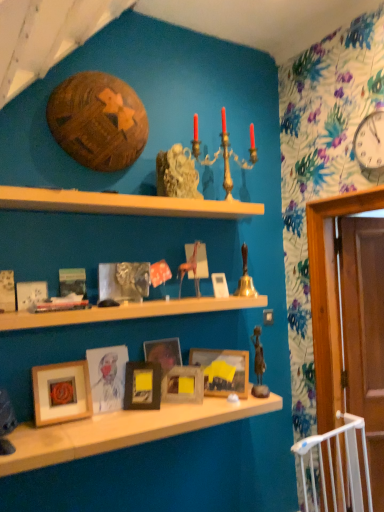
Find the location of a particular element. The width and height of the screenshot is (384, 512). wooden picture frame at lower left, the 6th picture frame when ordered from right to left is located at coordinates (61, 392).

Find the location of a particular element. This screenshot has width=384, height=512. white glossy clock at upper right is located at coordinates (370, 141).

Describe the element at coordinates (122, 431) in the screenshot. I see `wooden shelf at lower center, the first shelf when ordered from bottom to top` at that location.

How much space does wooden picture frame at center, marked as the 3th picture frame in a right-to-left arrangement, occupy horizontally?

It is 1.00 inches.

Where is `wooden picture frame at lower left, the 6th picture frame when ordered from right to left`? The width and height of the screenshot is (384, 512). wooden picture frame at lower left, the 6th picture frame when ordered from right to left is located at coordinates (61, 392).

Between wooden shelf at upper center, the first shelf when ordered from top to bottom, and wooden picture frame at center, marked as the 3th picture frame in a right-to-left arrangement, which one has less height?

With less height is wooden shelf at upper center, the first shelf when ordered from top to bottom.

Would you say wooden shelf at upper center, the third shelf ordered from the bottom, is to the left or to the right of wooden picture frame at center, marked as the 3th picture frame in a right-to-left arrangement, in the picture?

wooden shelf at upper center, the third shelf ordered from the bottom, is positioned on wooden picture frame at center, marked as the 3th picture frame in a right-to-left arrangement,'s left side.

From a real-world perspective, is wooden shelf at upper center, the third shelf ordered from the bottom, positioned above or below wooden picture frame at center, marked as the 3th picture frame in a right-to-left arrangement?

In terms of real-world spatial position, wooden shelf at upper center, the third shelf ordered from the bottom, is above wooden picture frame at center, marked as the 3th picture frame in a right-to-left arrangement.

From the picture: Does wooden shelf at upper center, the first shelf when ordered from top to bottom, contain wooden picture frame at center, marked as the 3th picture frame in a right-to-left arrangement?

No, wooden shelf at upper center, the first shelf when ordered from top to bottom, does not contain wooden picture frame at center, marked as the 3th picture frame in a right-to-left arrangement.

How distant is wooden picture frame at center, arranged as the first picture frame when viewed from the right, from wooden shelf at lower center, the first shelf when ordered from bottom to top?

wooden picture frame at center, arranged as the first picture frame when viewed from the right, is 33.33 inches from wooden shelf at lower center, the first shelf when ordered from bottom to top.

Is wooden picture frame at center, acting as the 7th picture frame starting from the left, turned away from wooden shelf at lower center, the third shelf viewed from the top?

wooden picture frame at center, acting as the 7th picture frame starting from the left, is not turned away from wooden shelf at lower center, the third shelf viewed from the top.

Does point (216, 295) come farther from viewer compared to point (248, 401)?

That is True.

How many degrees apart are the facing directions of wooden picture frame at center, arranged as the first picture frame when viewed from the right, and wooden shelf at lower center, the third shelf viewed from the top?

wooden picture frame at center, arranged as the first picture frame when viewed from the right, and wooden shelf at lower center, the third shelf viewed from the top, are facing 8.67 degrees away from each other.

Which object is thinner, wooden picture frame at center, marked as the 3th picture frame in a right-to-left arrangement, or wooden picture frame at center, acting as the 7th picture frame starting from the left?

With smaller width is wooden picture frame at center, marked as the 3th picture frame in a right-to-left arrangement.

Is there a large distance between wooden picture frame at center, marked as the 3th picture frame in a right-to-left arrangement, and wooden picture frame at center, acting as the 7th picture frame starting from the left?

No.

Can you confirm if wooden picture frame at center, the fifth picture frame from the left, is bigger than wooden picture frame at center, arranged as the first picture frame when viewed from the right?

Correct, wooden picture frame at center, the fifth picture frame from the left, is larger in size than wooden picture frame at center, arranged as the first picture frame when viewed from the right.

From the image's perspective, which one is positioned lower, wooden shelf at lower center, the first shelf when ordered from bottom to top, or matte wooden picture frame at center, positioned as the 3th picture frame in left-to-right order?

wooden shelf at lower center, the first shelf when ordered from bottom to top, from the image's perspective.

Would you say wooden shelf at lower center, the third shelf viewed from the top, is a long distance from matte wooden picture frame at center, the fifth picture frame when ordered from right to left?

No, wooden shelf at lower center, the third shelf viewed from the top, is in close proximity to matte wooden picture frame at center, the fifth picture frame when ordered from right to left.

Starting from the wooden shelf at lower center, the first shelf when ordered from bottom to top, which picture frame is the 3rd one behind? Please provide its 2D coordinates.

[(107, 377)]

Which is in front, wooden picture frame at lower left, placed as the 2th picture frame when sorted from left to right, or wooden shelf at upper center, the third shelf ordered from the bottom?

wooden shelf at upper center, the third shelf ordered from the bottom, is in front.

Is the surface of wooden picture frame at lower left, the 6th picture frame when ordered from right to left, in direct contact with wooden shelf at upper center, the third shelf ordered from the bottom?

No, wooden picture frame at lower left, the 6th picture frame when ordered from right to left, is not next to wooden shelf at upper center, the third shelf ordered from the bottom.

Is wooden picture frame at lower left, the 6th picture frame when ordered from right to left, wider or thinner than wooden shelf at upper center, the first shelf when ordered from top to bottom?

Considering their sizes, wooden picture frame at lower left, the 6th picture frame when ordered from right to left, looks slimmer than wooden shelf at upper center, the first shelf when ordered from top to bottom.

How much distance is there between wooden picture frame at lower left, placed as the 2th picture frame when sorted from left to right, and wooden shelf at upper center, the third shelf ordered from the bottom?

wooden picture frame at lower left, placed as the 2th picture frame when sorted from left to right, is 33.21 inches from wooden shelf at upper center, the third shelf ordered from the bottom.

Between matte white picture frame at center, which is counted as the first picture frame, starting from the left, and wooden picture frame at center, arranged as the sixth picture frame when viewed from the left, which one is positioned in front?

matte white picture frame at center, which is counted as the first picture frame, starting from the left.

Which picture frame is the 4th one when counting from the front of the wooden picture frame at center, which ranks as the second picture frame in right-to-left order? Please provide its 2D coordinates.

[(31, 294)]

Is matte white picture frame at center, acting as the seventh picture frame starting from the right, far from wooden picture frame at center, which ranks as the second picture frame in right-to-left order?

Actually, matte white picture frame at center, acting as the seventh picture frame starting from the right, and wooden picture frame at center, which ranks as the second picture frame in right-to-left order, are a little close together.

Is matte white picture frame at center, acting as the seventh picture frame starting from the right, wider or thinner than wooden picture frame at center, which ranks as the second picture frame in right-to-left order?

Considering their sizes, matte white picture frame at center, acting as the seventh picture frame starting from the right, looks slimmer than wooden picture frame at center, which ranks as the second picture frame in right-to-left order.

Is matte white picture frame at center, acting as the seventh picture frame starting from the right, facing towards matte black picture frame at center, the fourth picture frame positioned from the right?

No, matte white picture frame at center, acting as the seventh picture frame starting from the right, does not turn towards matte black picture frame at center, the fourth picture frame positioned from the right.

Which object is closer to the camera taking this photo, matte white picture frame at center, which is counted as the first picture frame, starting from the left, or matte black picture frame at center, which ranks as the fourth picture frame in left-to-right order?

matte white picture frame at center, which is counted as the first picture frame, starting from the left, is more forward.

Locate an element on the screen. Image resolution: width=384 pixels, height=512 pixels. picture frame that is the 4th object located above the matte black picture frame at center, the fourth picture frame positioned from the right (from the image's perspective) is located at coordinates (31, 294).

From a real-world perspective, which picture frame is the 7th one underneath the wooden shelf at upper center, the third shelf ordered from the bottom? Please provide its 2D coordinates.

[(183, 385)]

Identify the location of the 7th picture frame directly above the wooden shelf at lower center, the first shelf when ordered from bottom to top (from a real-world perspective). tap(220, 285).

When comparing their distances from wooden shelf at lower center, the third shelf viewed from the top, does wooden picture frame at lower left, the 6th picture frame when ordered from right to left, or wooden shelf at center, arranged as the second shelf when ordered from the bottom, seem closer?

wooden picture frame at lower left, the 6th picture frame when ordered from right to left, lies closer to wooden shelf at lower center, the third shelf viewed from the top, than the other object.

Based on their spatial positions, is wooden picture frame at lower left, placed as the 2th picture frame when sorted from left to right, or matte white picture frame at center, which is counted as the first picture frame, starting from the left, closer to wooden shelf at upper center, the first shelf when ordered from top to bottom?

Based on the image, matte white picture frame at center, which is counted as the first picture frame, starting from the left, appears to be nearer to wooden shelf at upper center, the first shelf when ordered from top to bottom.

Estimate the real-world distances between objects in this image. Which object is further from wooden picture frame at center, arranged as the first picture frame when viewed from the right, matte black picture frame at center, which ranks as the fourth picture frame in left-to-right order, or matte wooden picture frame at center, positioned as the 3th picture frame in left-to-right order?

Based on the image, matte wooden picture frame at center, positioned as the 3th picture frame in left-to-right order, appears to be further to wooden picture frame at center, arranged as the first picture frame when viewed from the right.

Based on their spatial positions, is wooden picture frame at center, arranged as the sixth picture frame when viewed from the left, or gold metallic candelabra at upper center closer to wooden picture frame at center, the fifth picture frame from the left?

wooden picture frame at center, arranged as the sixth picture frame when viewed from the left, lies closer to wooden picture frame at center, the fifth picture frame from the left, than the other object.

Estimate the real-world distances between objects in this image. Which object is further from white glossy clock at upper right, matte white picture frame at center, acting as the seventh picture frame starting from the right, or wooden picture frame at center, which ranks as the second picture frame in right-to-left order?

Based on the image, matte white picture frame at center, acting as the seventh picture frame starting from the right, appears to be further to white glossy clock at upper right.

Estimate the real-world distances between objects in this image. Which object is closer to matte white picture frame at center, acting as the seventh picture frame starting from the right, matte black picture frame at center, the fourth picture frame positioned from the right, or wooden picture frame at center, which ranks as the second picture frame in right-to-left order?

matte black picture frame at center, the fourth picture frame positioned from the right, is positioned closer to the anchor matte white picture frame at center, acting as the seventh picture frame starting from the right.

Considering their positions, is wooden shelf at center, the 2th shelf when ordered from top to bottom, positioned closer to gold metallic candelabra at upper center than matte wooden picture frame at center, the fifth picture frame when ordered from right to left?

wooden shelf at center, the 2th shelf when ordered from top to bottom, is positioned closer to the anchor gold metallic candelabra at upper center.

Which object lies further to the anchor point gold metallic candelabra at upper center, matte black picture frame at center, the fourth picture frame positioned from the right, or wooden shelf at center, the 2th shelf when ordered from top to bottom?

Among the two, matte black picture frame at center, the fourth picture frame positioned from the right, is located further to gold metallic candelabra at upper center.

This screenshot has width=384, height=512. What are the coordinates of `picture frame between matte black picture frame at center, which ranks as the fourth picture frame in left-to-right order, and wooden picture frame at center, arranged as the sixth picture frame when viewed from the left, from left to right` in the screenshot? It's located at (183, 385).

Locate an element on the screen. This screenshot has width=384, height=512. toy between white glossy clock at upper right and wooden picture frame at center, arranged as the sixth picture frame when viewed from the left, in the up-down direction is located at coordinates (259, 366).

You are a GUI agent. You are given a task and a screenshot of the screen. Output one action in this format:
    pyautogui.click(x=<x>, y=<y>)
    Task: Click on the toy that lies between wooden picture frame at center, acting as the 7th picture frame starting from the left, and wooden picture frame at center, the fifth picture frame from the left, from top to bottom
    Image resolution: width=384 pixels, height=512 pixels.
    Given the screenshot: What is the action you would take?
    pyautogui.click(x=259, y=366)

Where is `shelf between wooden shelf at upper center, the first shelf when ordered from top to bottom, and bronze statue at center-right vertically`? shelf between wooden shelf at upper center, the first shelf when ordered from top to bottom, and bronze statue at center-right vertically is located at coordinates (128, 311).